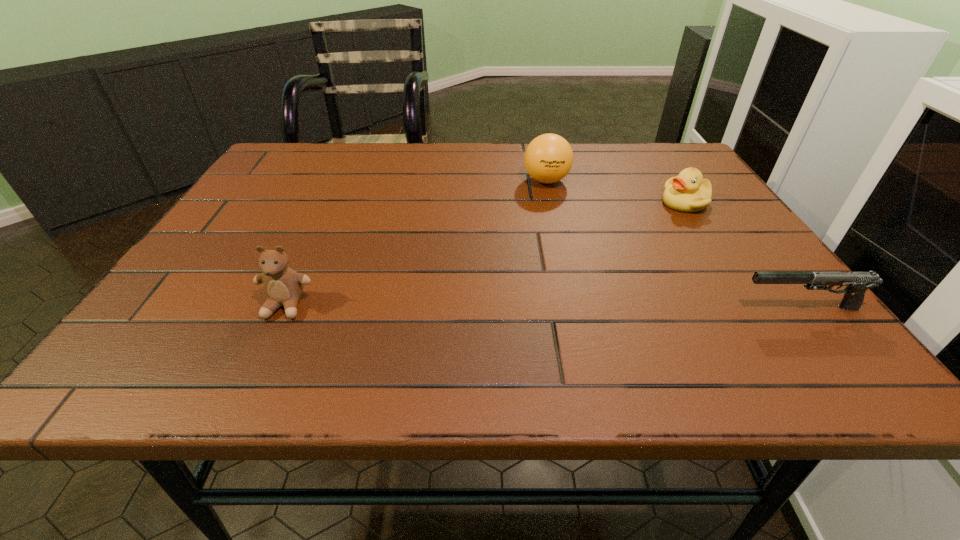
Where is `the leftmost object`? This screenshot has height=540, width=960. the leftmost object is located at coordinates (283, 286).

This screenshot has width=960, height=540. Identify the location of gun. pos(856,283).

The image size is (960, 540). I want to click on duckling, so click(687, 192).

Find the location of `ping-pong ball`. ping-pong ball is located at coordinates click(x=548, y=158).

Identify the location of blank area located at the muzzle end of the gun. Image resolution: width=960 pixels, height=540 pixels. (553, 308).

This screenshot has width=960, height=540. I want to click on vacant space located at the muzzle end of the gun, so click(531, 308).

I want to click on vacant space situated at the muzzle end of the gun, so click(613, 308).

Find the location of a particular element. This screenshot has width=960, height=540. free space located 0.330m at the face of the duckling is located at coordinates (584, 271).

Locate an element on the screen. The height and width of the screenshot is (540, 960). vacant space situated 0.380m at the face of the duckling is located at coordinates (567, 281).

Image resolution: width=960 pixels, height=540 pixels. In order to click on free space located 0.280m at the face of the duckling in this screenshot , I will do `click(599, 260)`.